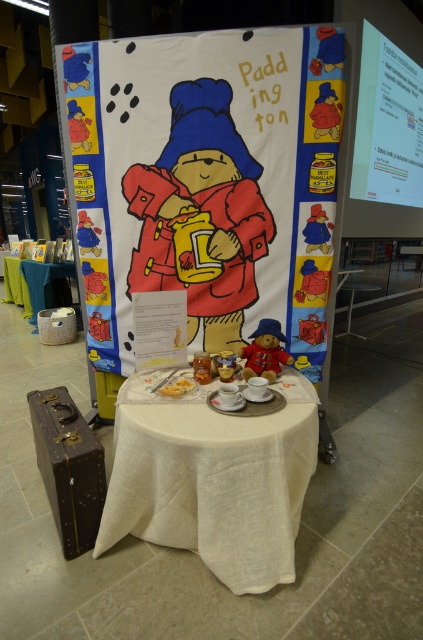
Can you confirm if leather suitcase at lower left is bigger than white fabric table at lower left?

Incorrect, leather suitcase at lower left is not larger than white fabric table at lower left.

How much distance is there between leather suitcase at lower left and white fabric table at lower left?

leather suitcase at lower left is 3.51 meters away from white fabric table at lower left.

Between point (52, 506) and point (41, 308), which one is positioned behind?

The point (41, 308) is more distant.

Where is `leather suitcase at lower left`? This screenshot has width=423, height=640. leather suitcase at lower left is located at coordinates (68, 467).

Does leather suitcase at lower left have a larger size compared to yellow matte cake at center?

Indeed, leather suitcase at lower left has a larger size compared to yellow matte cake at center.

Who is positioned more to the right, leather suitcase at lower left or yellow matte cake at center?

Positioned to the right is yellow matte cake at center.

This screenshot has height=640, width=423. In order to click on leather suitcase at lower left in this screenshot , I will do `click(68, 467)`.

Find the location of a particular element. leather suitcase at lower left is located at coordinates (68, 467).

Does matte paper paddington bear poster at center have a lesser height compared to white linen table at center?

In fact, matte paper paddington bear poster at center may be taller than white linen table at center.

Does matte paper paddington bear poster at center have a lesser width compared to white linen table at center?

In fact, matte paper paddington bear poster at center might be wider than white linen table at center.

Between point (140, 84) and point (126, 435), which one is positioned in front?

Positioned in front is point (126, 435).

Find the location of `matte paper paddington bear poster at center`. matte paper paddington bear poster at center is located at coordinates (206, 182).